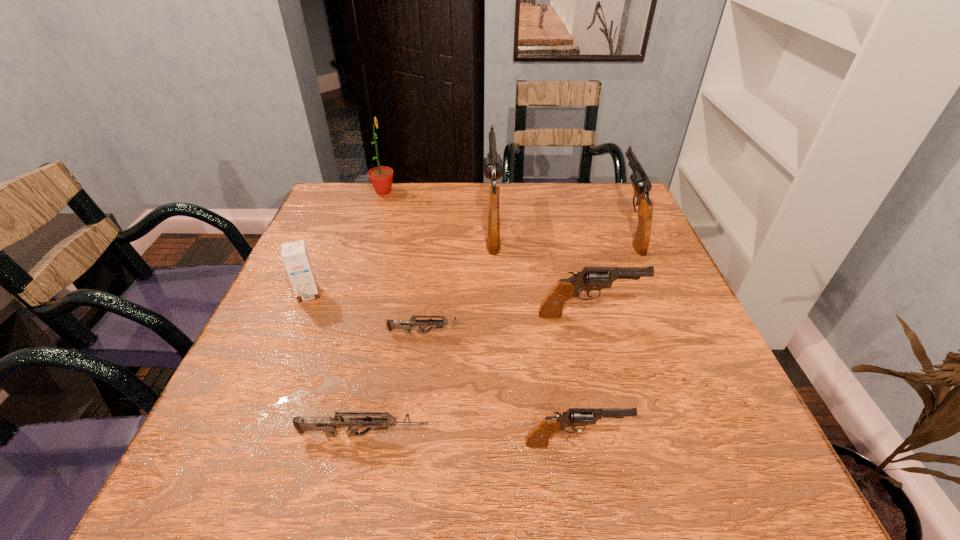
You are a GUI agent. You are given a task and a screenshot of the screen. Output one action in this format:
    pyautogui.click(x=<x>, y=<y>)
    Task: Click on the blank area at the near edge
    Image resolution: width=960 pixels, height=540 pixels.
    Given the screenshot: What is the action you would take?
    pyautogui.click(x=334, y=488)

In the image, there is a desktop. At what (x,y) coordinates should I click in order to perform the action: click on free space at the left edge. Please return your answer as a coordinate pair (x, y). Looking at the image, I should click on (324, 273).

The height and width of the screenshot is (540, 960). Identify the location of blank space at the right edge. (628, 295).

This screenshot has width=960, height=540. I want to click on vacant region at the far left corner of the desktop, so click(365, 190).

In order to click on vacant space at the far right corner of the desktop in this screenshot , I will do `click(592, 227)`.

You are a GUI agent. You are given a task and a screenshot of the screen. Output one action in this format:
    pyautogui.click(x=<x>, y=<y>)
    Task: Click on the unoccupied position between the fourth tallest gun and the third smallest black gun
    
    Given the screenshot: What is the action you would take?
    pyautogui.click(x=602, y=334)

Locate an element on the screen. The image size is (960, 540). free space between the rightmost black gun and the shortest gun is located at coordinates (529, 279).

Locate an element on the screen. Image resolution: width=960 pixels, height=540 pixels. free point between the fourth object from right to left and the sunflower is located at coordinates (438, 205).

Locate an element on the screen. vacant space that's between the seventh tallest object and the rightmost object is located at coordinates (497, 330).

The image size is (960, 540). I want to click on free spot between the second nearest black gun and the nearest black gun, so click(x=582, y=379).